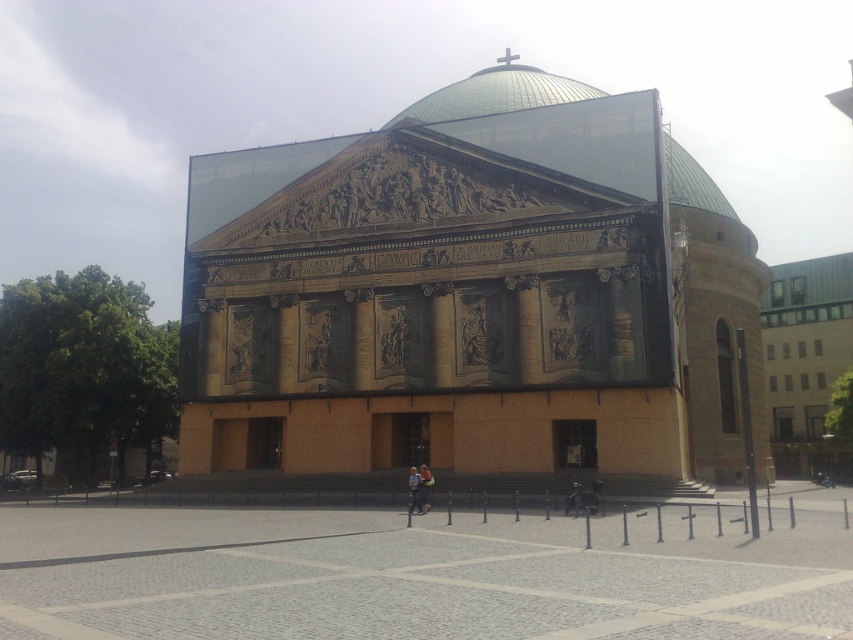
Based on the provided scene description, where is the green metal building at right located in terms of coordinates?

The green metal building at right is located at point (805,358).

You are standing in front of the grand architectural structure. You notice a light blue denim jacket at center and a green metal building at right. Which object is positioned to the right of the other?

The green metal building at right is positioned to the right of the light blue denim jacket at center.

You are standing in front of the grand architectural structure and notice both the gray cobblestone plaza at center and the light blue denim jacket at center. Which object is positioned higher from the ground?

The light blue denim jacket at center is positioned higher from the ground than the gray cobblestone plaza at center because the gray cobblestone plaza at center is below the light blue denim jacket at center.